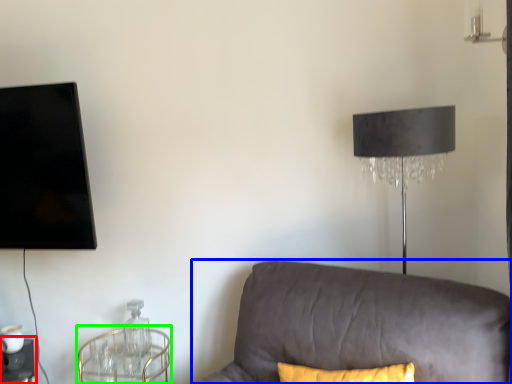
Question: Which object is the farthest from table (highlighted by a red box)? Choose among these: studio couch (highlighted by a blue box) or round table (highlighted by a green box).

Choices:
 (A) studio couch
 (B) round table

Answer: (A)